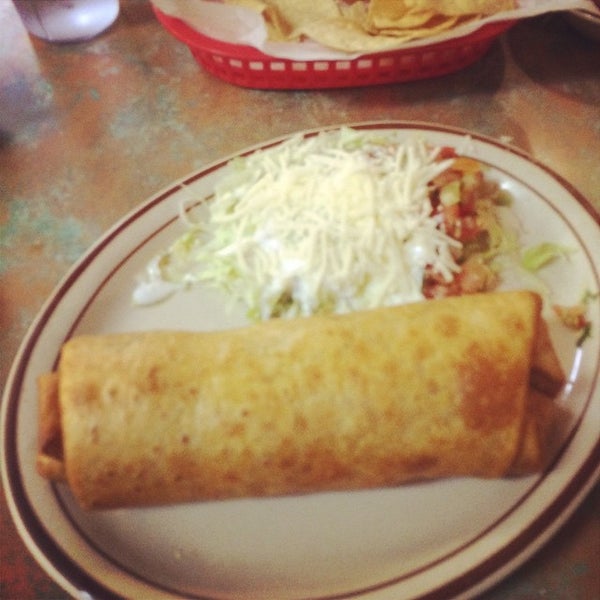
Locate an element on the screen. Image resolution: width=600 pixels, height=600 pixels. stone look table top is located at coordinates (141, 115).